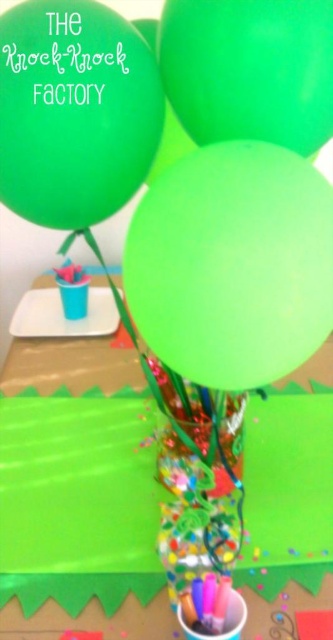
You are planning to hang decorations for an event and have two balloons available. You need to choose one that can reach a higher position when inflated. Which balloon should you select between the green rubber balloon at center and the matte green balloon at upper left?

The green rubber balloon at center has a greater height compared to the matte green balloon at upper left, so you should choose the green rubber balloon at center to reach a higher position when inflated.

You are planning to hang two balloons from the ceiling for a party decoration. The balloons are the matte green balloon at upper left and the green matte balloon at upper center. Which balloon should you choose if you want the one that reaches higher?

The matte green balloon at upper left is much taller than the green matte balloon at upper center, so you should choose the matte green balloon at upper left to reach higher.

You are standing at a distance of 10 inches from the table. You want to reach the point marked at point (86, 177). Can you reach it without moving closer?

The distance between you and the point (86, 177) is 12.75 inches. Since you are only 10 inches away from the table, you cannot reach the point without moving closer.